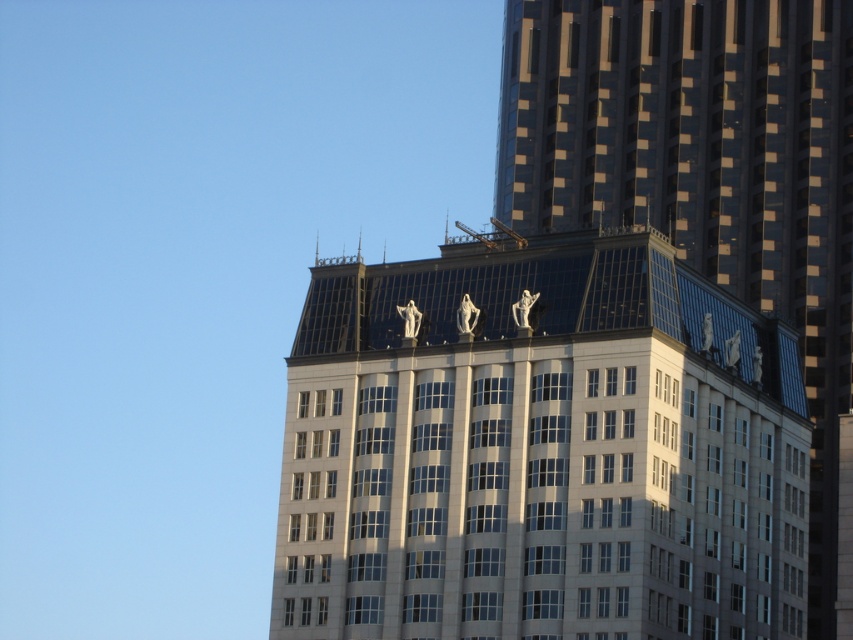
You are standing at the base of the modern highrise building. You want to take a photo of the white marble statues at upper center. Where should you position yourself to capture them in the frame?

The white marble statues at upper center are located at point (x=538, y=449), so you should position yourself directly in front of the building at that coordinate to capture them in the frame.

You are a window cleaner working on the reflective glass skyscraper at upper center. You notice the white marble statues at upper center nearby. How does the height of the statues compare to the skyscraper?

The white marble statues at upper center are shorter than the reflective glass skyscraper at upper center.

You are standing on the ground floor of the modern high rise building and looking up. You notice a point marked at coordinates (538, 449). What object is located at that point?

The point at (538, 449) is where the white marble statues at upper center are located.